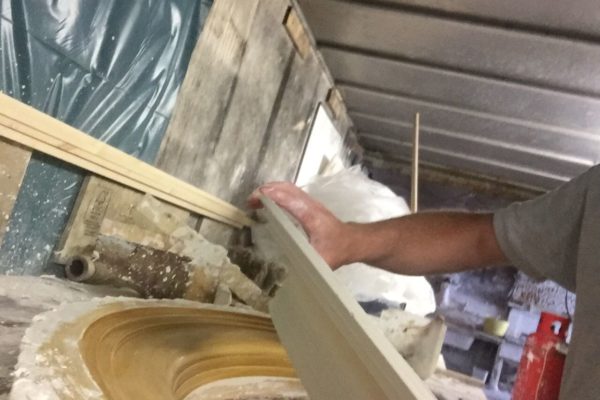
The height and width of the screenshot is (400, 600). Find the location of `back of workshop`. back of workshop is located at coordinates (528, 318).